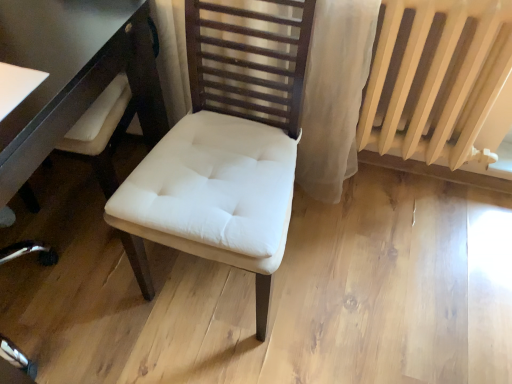
Question: Would you say white glossy table at left is to the left or to the right of white fabric chair at center in the picture?

Choices:
 (A) left
 (B) right

Answer: (A)

Question: From the image's perspective, is white glossy table at left positioned above or below white fabric chair at center?

Choices:
 (A) below
 (B) above

Answer: (B)

Question: Which is nearer to the white fabric chair at center?

Choices:
 (A) beige painted radiator at right
 (B) white glossy table at left

Answer: (B)

Question: Which object is positioned closest to the white fabric chair at center?

Choices:
 (A) beige painted radiator at right
 (B) white glossy table at left

Answer: (B)